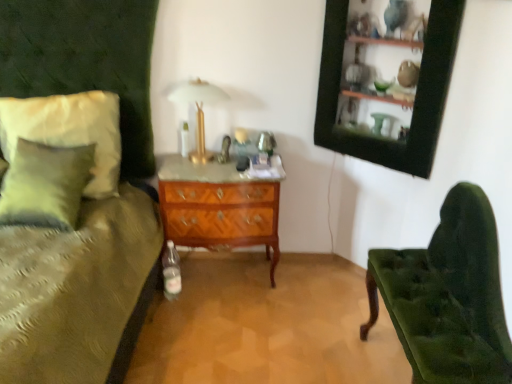
The image size is (512, 384). Find the location of `free spot above woodenwoodenchest of drawers at center (from a real-world perspective)`. free spot above woodenwoodenchest of drawers at center (from a real-world perspective) is located at coordinates point(214,167).